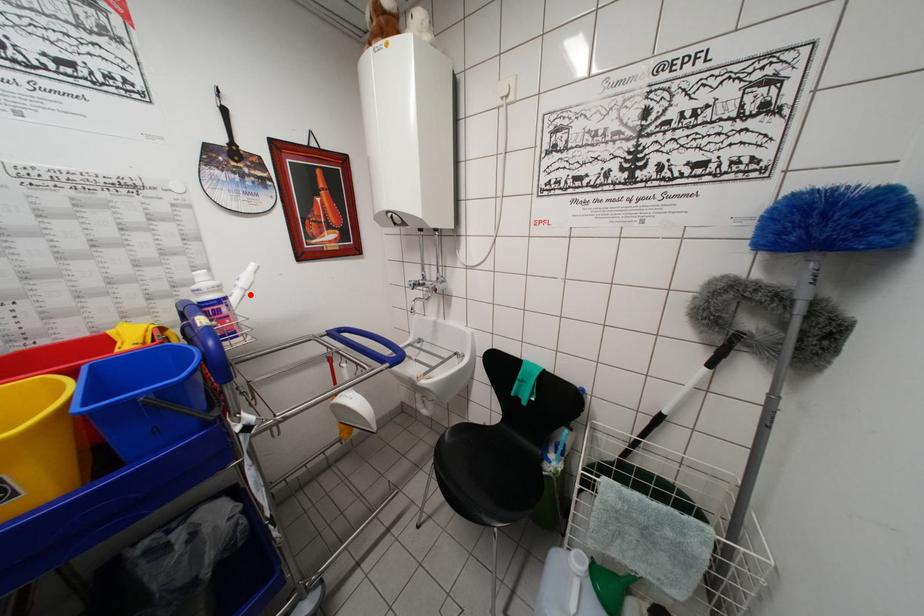
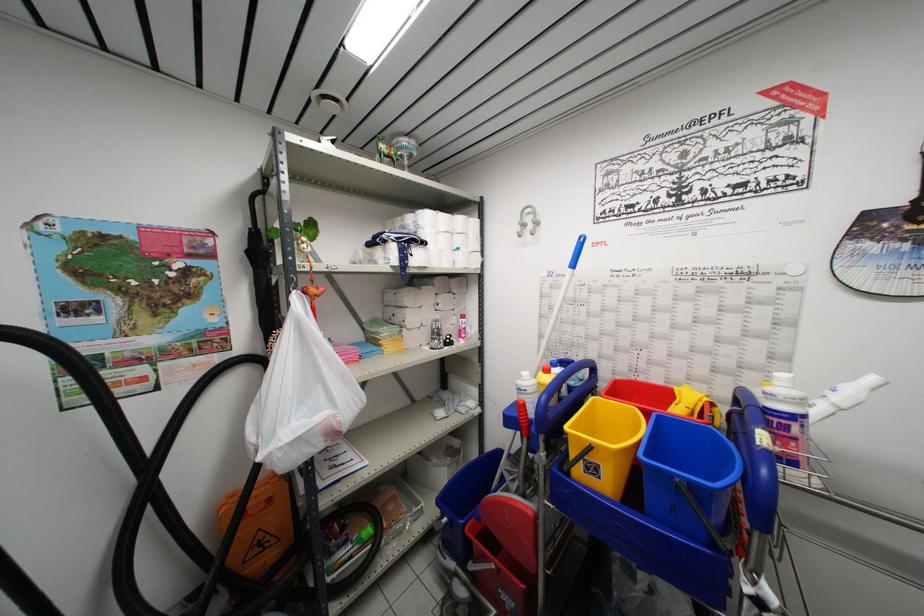
Question: I am providing you with two images of the same scene from different viewpoints. Given a red point in image1, look at the same physical point in image2. Is it:

Choices:
 (A) Closer to the viewpoint
 (B) Farther from the viewpoint

Answer: (A)